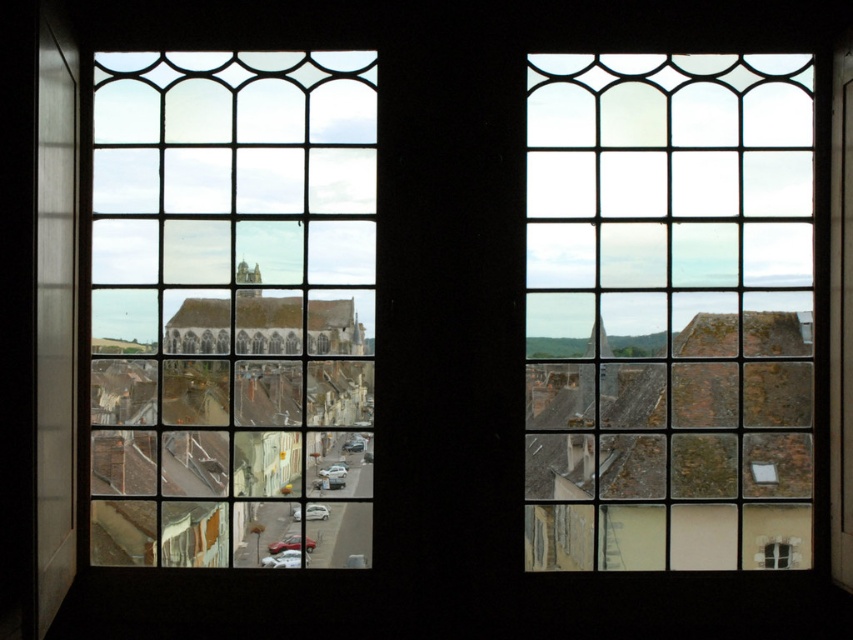
Question: Is clear glass window at upper right positioned in front of clear glass window at center?

Choices:
 (A) yes
 (B) no

Answer: (B)

Question: Which of the following is the farthest from the observer?

Choices:
 (A) (538, 296)
 (B) (140, 243)

Answer: (B)

Question: Which of the following is the farthest from the observer?

Choices:
 (A) (653, 509)
 (B) (132, 339)

Answer: (A)

Question: Observing the image, what is the correct spatial positioning of clear glass window at upper right in reference to clear glass window at center?

Choices:
 (A) right
 (B) left

Answer: (A)

Question: Does clear glass window at upper right have a greater width compared to clear glass window at center?

Choices:
 (A) no
 (B) yes

Answer: (A)